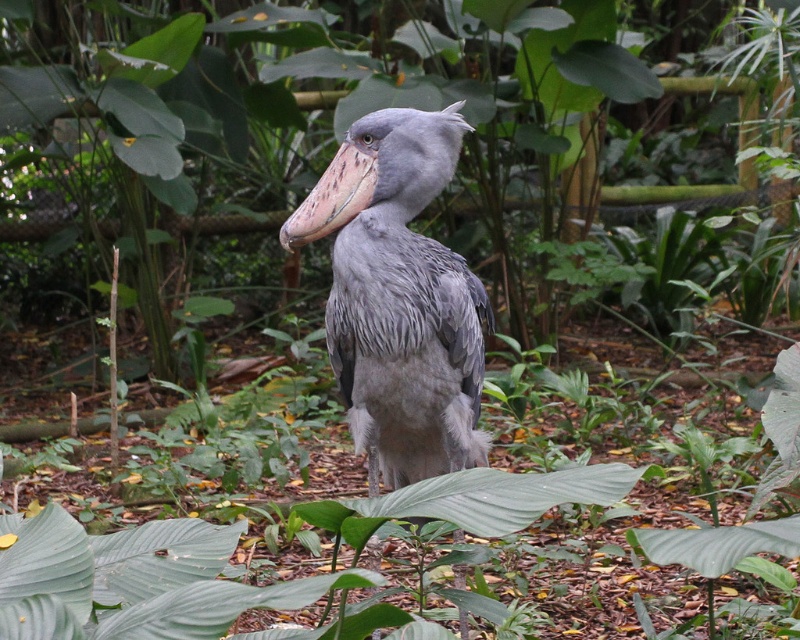
Question: Which point is closer to the camera?

Choices:
 (A) gray matte bird at center
 (B) pinkish-brown textured beak at center

Answer: (B)

Question: Does gray matte bird at center have a lesser width compared to pinkish-brown textured beak at center?

Choices:
 (A) no
 (B) yes

Answer: (A)

Question: In this image, where is gray matte bird at center located relative to pinkish-brown textured beak at center?

Choices:
 (A) left
 (B) right

Answer: (B)

Question: Which object is farther from the camera taking this photo?

Choices:
 (A) pinkish-brown textured beak at center
 (B) gray matte bird at center

Answer: (B)

Question: In this image, where is gray matte bird at center located relative to pinkish-brown textured beak at center?

Choices:
 (A) below
 (B) above

Answer: (A)